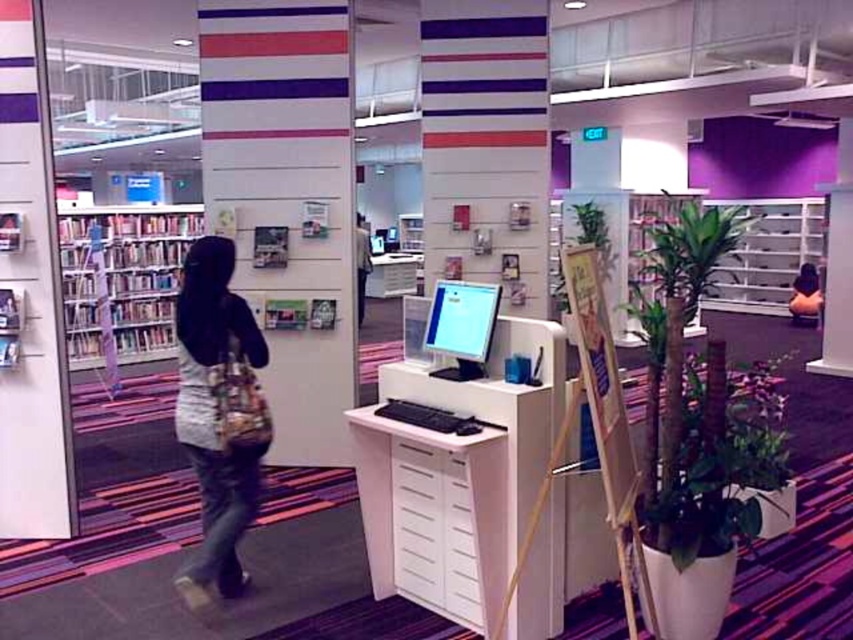
Can you confirm if white glossy pillar at center is wider than metallic silver bookshelf at right?

Correct, the width of white glossy pillar at center exceeds that of metallic silver bookshelf at right.

Which is behind, point (334, 458) or point (764, 216)?

The point (764, 216) is behind.

The width and height of the screenshot is (853, 640). What do you see at coordinates (286, 198) in the screenshot? I see `white glossy pillar at center` at bounding box center [286, 198].

I want to click on white glossy pillar at center, so click(286, 198).

Can you confirm if denim jeans at left is bigger than matte black monitor at center?

Indeed, denim jeans at left has a larger size compared to matte black monitor at center.

Who is more forward, [231,390] or [444,314]?

Point [231,390] is more forward.

Does point (225, 349) come behind point (450, 369)?

No, (225, 349) is closer to viewer.

Where is `denim jeans at left`? This screenshot has width=853, height=640. denim jeans at left is located at coordinates (219, 413).

Is point (596, 314) closer to viewer compared to point (416, 355)?

Yes, point (596, 314) is in front of point (416, 355).

Who is positioned more to the right, wooden easel at center or satin silver monitor at center?

Positioned to the right is wooden easel at center.

Is point (515, 572) positioned behind point (421, 348)?

No, (515, 572) is closer to viewer.

Where is `wooden easel at center`? The width and height of the screenshot is (853, 640). wooden easel at center is located at coordinates (595, 436).